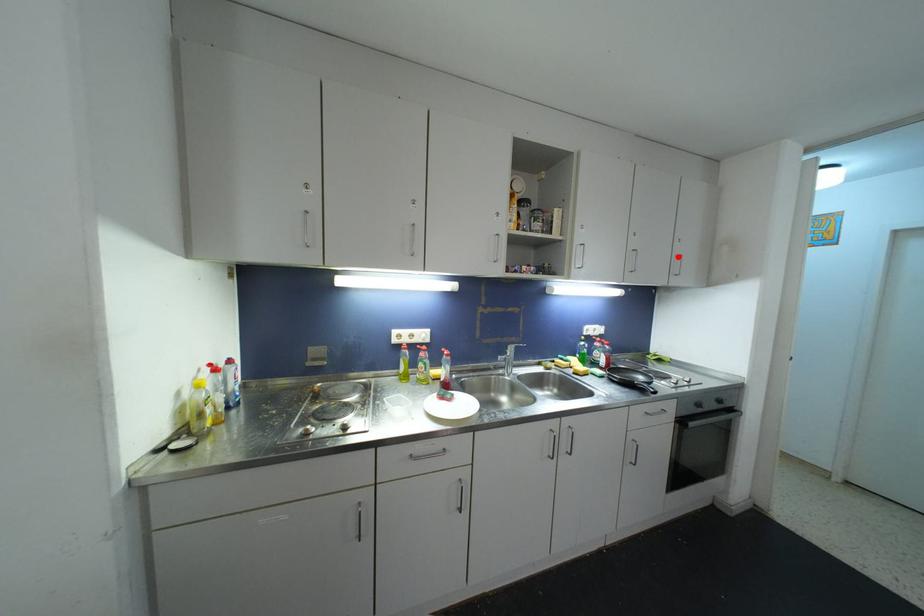
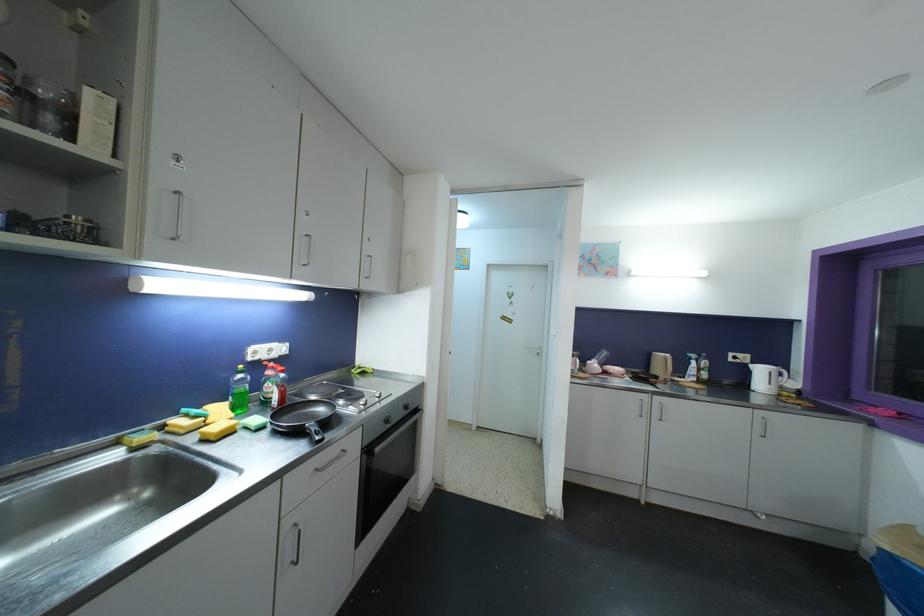
Find the pixel in the second image that matches the highlighted location in the first image.

(369, 257)